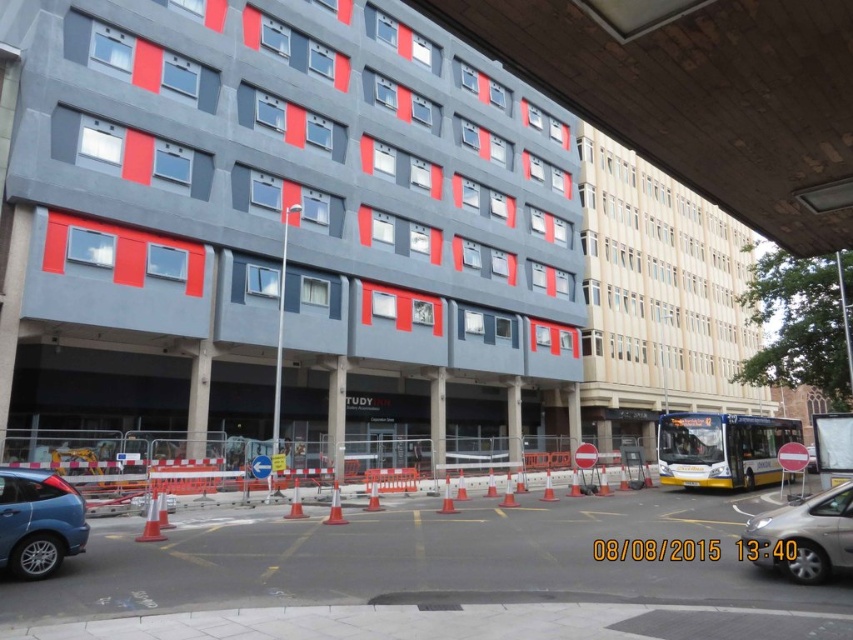
Question: Is metallic blue suv at lower left above silver metallic car at lower right?

Choices:
 (A) no
 (B) yes

Answer: (B)

Question: Which point appears closest to the camera in this image?

Choices:
 (A) (21, 502)
 (B) (833, 493)

Answer: (A)

Question: Which of the following is the farthest from the observer?

Choices:
 (A) (848, 531)
 (B) (10, 541)

Answer: (B)

Question: Does metallic blue suv at lower left appear under silver metallic car at lower right?

Choices:
 (A) no
 (B) yes

Answer: (A)

Question: Is metallic blue suv at lower left above silver metallic car at lower right?

Choices:
 (A) yes
 (B) no

Answer: (A)